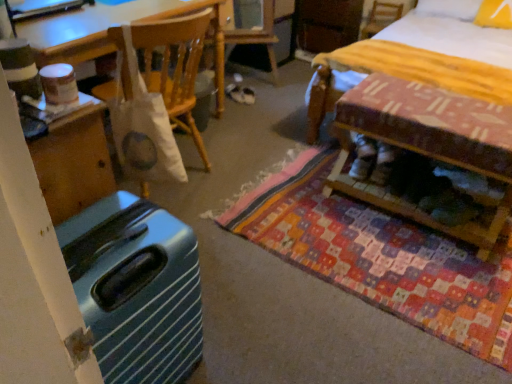
Question: Is white fabric bag at upper center oriented towards white suede shoes at center?

Choices:
 (A) no
 (B) yes

Answer: (A)

Question: Considering the relative sizes of white fabric bag at upper center and white suede shoes at center in the image provided, is white fabric bag at upper center wider than white suede shoes at center?

Choices:
 (A) yes
 (B) no

Answer: (A)

Question: Is white fabric bag at upper center not close to white suede shoes at center?

Choices:
 (A) no
 (B) yes

Answer: (A)

Question: From the image's perspective, does white fabric bag at upper center appear lower than white suede shoes at center?

Choices:
 (A) no
 (B) yes

Answer: (A)

Question: Is white fabric bag at upper center positioned before white suede shoes at center?

Choices:
 (A) no
 (B) yes

Answer: (B)

Question: Is white suede shoes at center inside the boundaries of patchwork fabric mat at center, or outside?

Choices:
 (A) inside
 (B) outside

Answer: (B)

Question: From a real-world perspective, is white suede shoes at center physically located above or below patchwork fabric mat at center?

Choices:
 (A) below
 (B) above

Answer: (B)

Question: Would you say white suede shoes at center is to the left or to the right of patchwork fabric mat at center in the picture?

Choices:
 (A) left
 (B) right

Answer: (A)

Question: From the image's perspective, is white suede shoes at center located above or below patchwork fabric mat at center?

Choices:
 (A) below
 (B) above

Answer: (B)

Question: From a real-world perspective, is white suede shoes at center physically located above or below yellow striped fabric bed at upper right?

Choices:
 (A) below
 (B) above

Answer: (A)

Question: Considering the positions of white suede shoes at center and yellow striped fabric bed at upper right in the image, is white suede shoes at center wider or thinner than yellow striped fabric bed at upper right?

Choices:
 (A) thin
 (B) wide

Answer: (A)

Question: From their relative heights in the image, would you say white suede shoes at center is taller or shorter than yellow striped fabric bed at upper right?

Choices:
 (A) short
 (B) tall

Answer: (A)

Question: From the image's perspective, is white suede shoes at center above or below yellow striped fabric bed at upper right?

Choices:
 (A) above
 (B) below

Answer: (B)

Question: In terms of width, does white suede shoes at center look wider or thinner when compared to yellow fabric pillow at upper right?

Choices:
 (A) wide
 (B) thin

Answer: (B)

Question: Is white suede shoes at center bigger or smaller than yellow fabric pillow at upper right?

Choices:
 (A) big
 (B) small

Answer: (B)